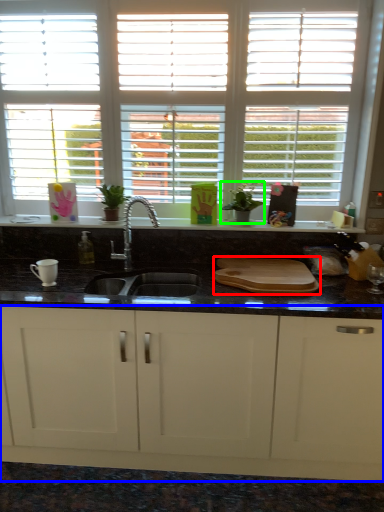
Question: Which object is the closest to the tray (highlighted by a red box)? Choose among these: cabinetry (highlighted by a blue box) or plant (highlighted by a green box).

Choices:
 (A) cabinetry
 (B) plant

Answer: (B)